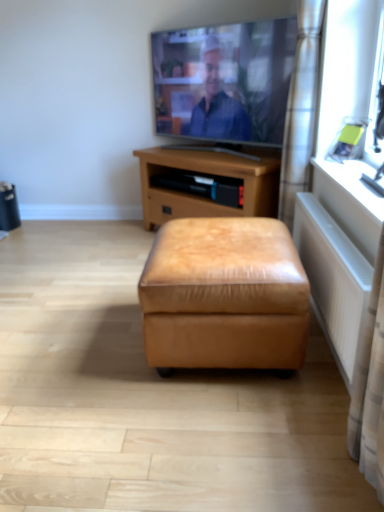
Find the location of a particular element. The width and height of the screenshot is (384, 512). free location above tan leather ottoman at center (from a real-world perspective) is located at coordinates (229, 241).